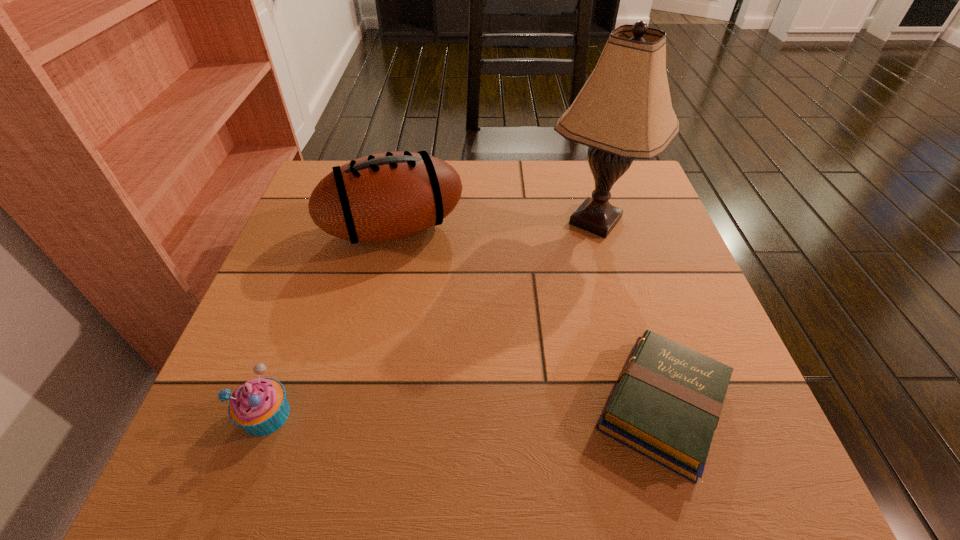
Find the location of a particular element. The height and width of the screenshot is (540, 960). free space that is in between the second tallest object and the lamp is located at coordinates (494, 225).

At what (x,y) coordinates should I click in order to perform the action: click on free space between the shortest object and the muffin. Please return your answer as a coordinate pair (x, y). The image size is (960, 540). Looking at the image, I should click on (465, 410).

Find the location of a particular element. blank region between the lamp and the second shortest object is located at coordinates (431, 318).

You are a GUI agent. You are given a task and a screenshot of the screen. Output one action in this format:
    pyautogui.click(x=<x>, y=<y>)
    Task: Click on the vacant point located between the muffin and the football (American)
    Image resolution: width=960 pixels, height=540 pixels.
    Given the screenshot: What is the action you would take?
    pyautogui.click(x=330, y=322)

Locate which object is the closest to the book. Please provide its 2D coordinates. Your answer should be formatted as a tuple, i.e. [(x, y)], where the tuple contains the x and y coordinates of a point satisfying the conditions above.

[(624, 111)]

The width and height of the screenshot is (960, 540). I want to click on object that is the closest to the lamp, so 387,196.

Locate an element on the screen. This screenshot has width=960, height=540. free location that satisfies the following two spatial constraints: 1. on the front side of the third shortest object; 2. on the left side of the shortest object is located at coordinates pyautogui.click(x=357, y=406).

What are the coordinates of `free location that satisfies the following two spatial constraints: 1. on the back side of the lamp; 2. on the left side of the muffin` in the screenshot? It's located at (336, 221).

Locate an element on the screen. free region that satisfies the following two spatial constraints: 1. on the back side of the lamp; 2. on the right side of the third shortest object is located at coordinates (396, 221).